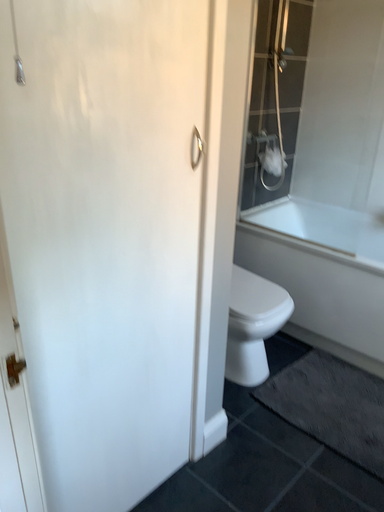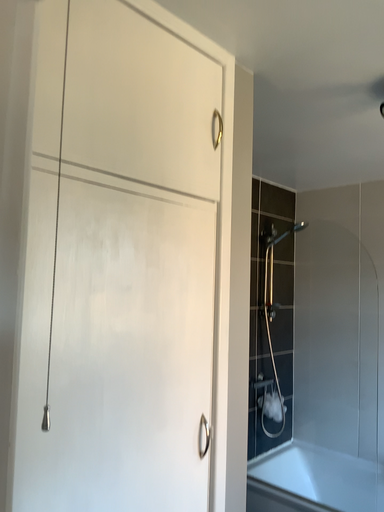
Question: How did the camera likely rotate when shooting the video?

Choices:
 (A) rotated downward
 (B) rotated upward

Answer: (B)